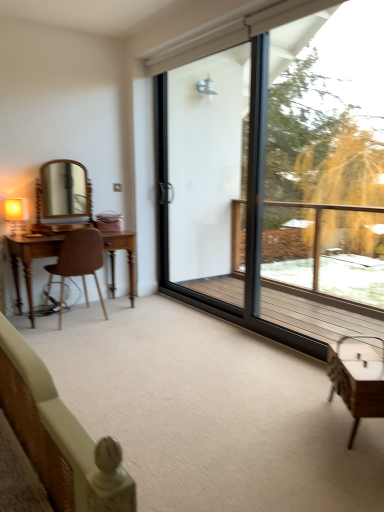
Question: From the image's perspective, is wooden desk at left, the first table positioned from the left, beneath green leafy tree at right?

Choices:
 (A) no
 (B) yes

Answer: (B)

Question: Can you confirm if wooden desk at left, acting as the 2th table starting from the right, is thinner than green leafy tree at right?

Choices:
 (A) yes
 (B) no

Answer: (B)

Question: Is wooden desk at left, the first table positioned from the left, smaller than green leafy tree at right?

Choices:
 (A) yes
 (B) no

Answer: (A)

Question: From a real-world perspective, is wooden desk at left, the first table positioned from the left, on green leafy tree at right?

Choices:
 (A) yes
 (B) no

Answer: (B)

Question: Can you confirm if wooden desk at left, acting as the 2th table starting from the right, is positioned to the right of green leafy tree at right?

Choices:
 (A) yes
 (B) no

Answer: (B)

Question: Does wooden desk at left, the first table in the back-to-front sequence, have a lesser height compared to green leafy tree at right?

Choices:
 (A) no
 (B) yes

Answer: (B)

Question: Does white glossy table at lower right, which is counted as the second table, starting from the back, have a larger size compared to brown leather chair at left?

Choices:
 (A) yes
 (B) no

Answer: (B)

Question: From the image's perspective, is white glossy table at lower right, which is the 1th table from right to left, beneath brown leather chair at left?

Choices:
 (A) no
 (B) yes

Answer: (B)

Question: Is white glossy table at lower right, which is the first table in front-to-back order, taller than brown leather chair at left?

Choices:
 (A) no
 (B) yes

Answer: (A)

Question: Does white glossy table at lower right, which is the 1th table from right to left, come in front of brown leather chair at left?

Choices:
 (A) yes
 (B) no

Answer: (A)

Question: Can you confirm if white glossy table at lower right, which is the first table in front-to-back order, is wider than brown leather chair at left?

Choices:
 (A) no
 (B) yes

Answer: (A)

Question: Are white glossy table at lower right, which is the first table in front-to-back order, and brown leather chair at left far apart?

Choices:
 (A) yes
 (B) no

Answer: (A)

Question: Is transparent glass window at center thinner than matte gold table lamp at left?

Choices:
 (A) no
 (B) yes

Answer: (B)